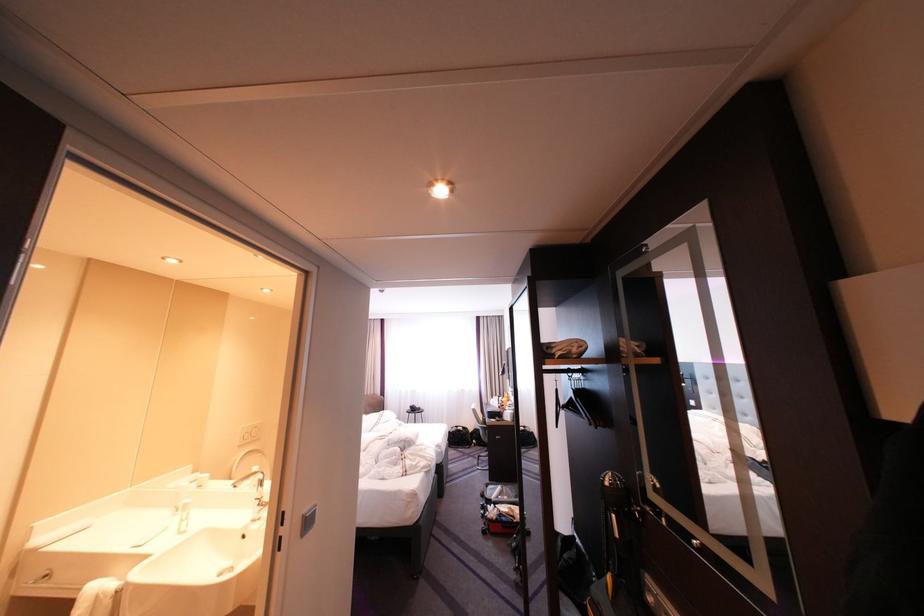
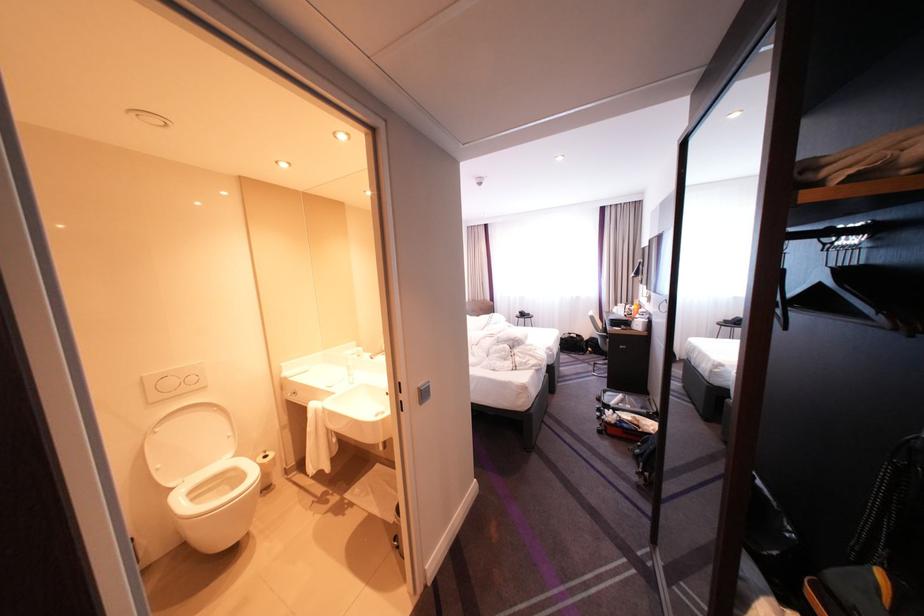
In the second image, find the point that corresponds to (x=590, y=389) in the first image.

(855, 265)